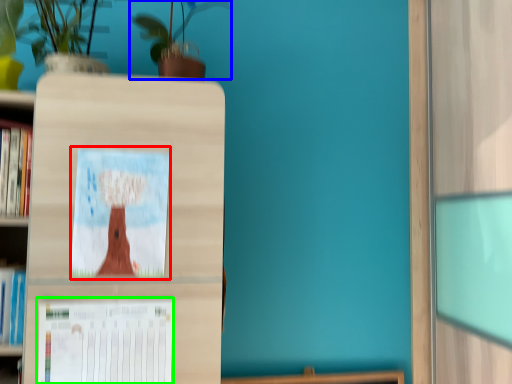
Question: Based on their relative distances, which object is farther from picture frame (highlighted by a red box)? Choose from houseplant (highlighted by a blue box) and paperback book (highlighted by a green box).

Choices:
 (A) houseplant
 (B) paperback book

Answer: (A)